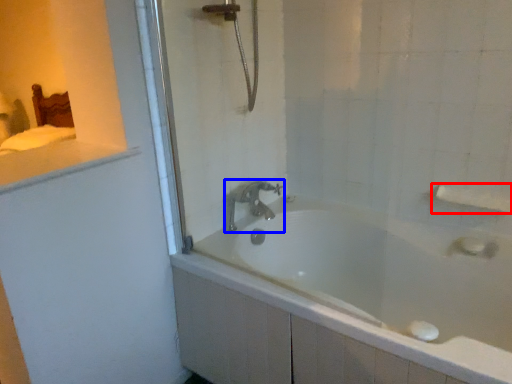
Question: Among these objects, which one is nearest to the camera, towel bar (highlighted by a red box) or tap (highlighted by a blue box)?

Choices:
 (A) towel bar
 (B) tap

Answer: (A)